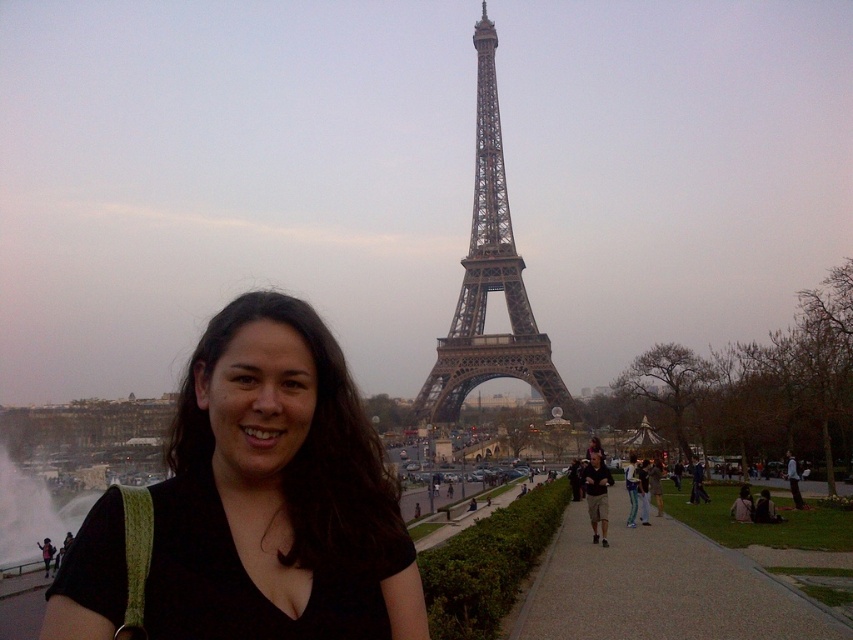
Question: Can you confirm if black matte shirt at center is positioned to the left of metallic brown eiffel tower at center?

Choices:
 (A) no
 (B) yes

Answer: (B)

Question: Among these points, which one is farthest from the camera?

Choices:
 (A) (521, 314)
 (B) (607, 516)
 (C) (412, 605)

Answer: (B)

Question: Estimate the real-world distances between objects in this image. Which object is farther from the black matte shirt at center?

Choices:
 (A) metallic brown eiffel tower at center
 (B) matte black shirt at center

Answer: (B)

Question: Can you confirm if metallic brown eiffel tower at center is bigger than matte black shirt at center?

Choices:
 (A) yes
 (B) no

Answer: (A)

Question: From the image, what is the correct spatial relationship of metallic brown eiffel tower at center in relation to matte black shirt at center?

Choices:
 (A) right
 (B) left

Answer: (B)

Question: Which object is positioned closest to the black matte shirt at center?

Choices:
 (A) metallic brown eiffel tower at center
 (B) matte black shirt at center

Answer: (A)